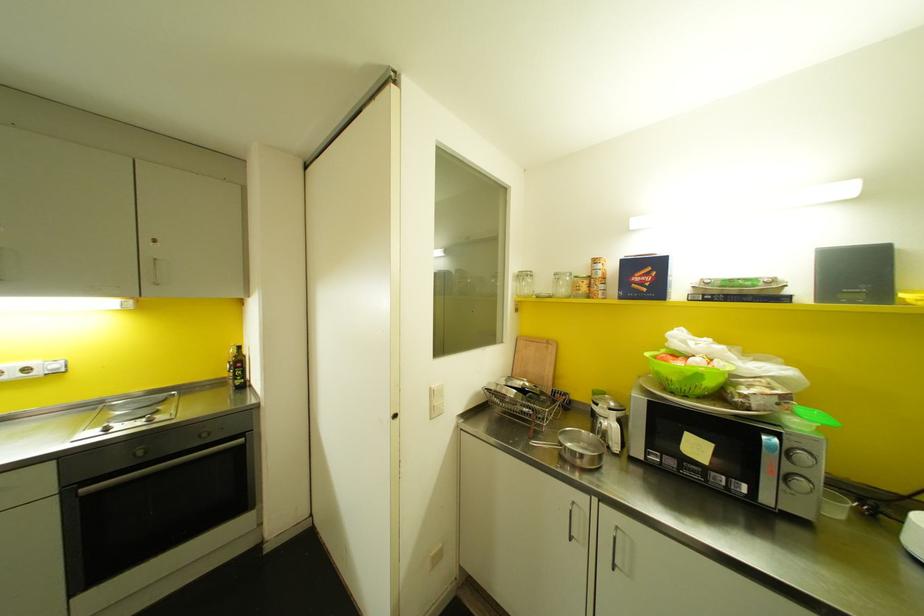
Which object does [237,369] point to?

It refers to a dark glass bottle.